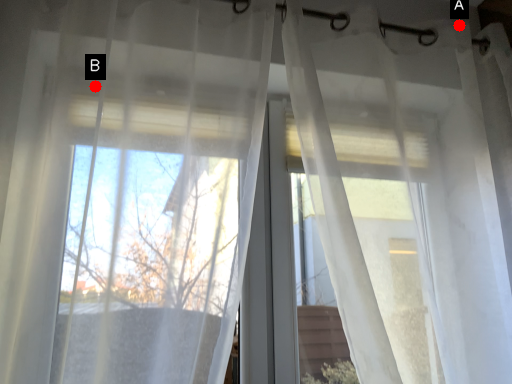
Question: Two points are circled on the image, labeled by A and B beside each circle. Which point is farther to the camera?

Choices:
 (A) A is further
 (B) B is further

Answer: (A)